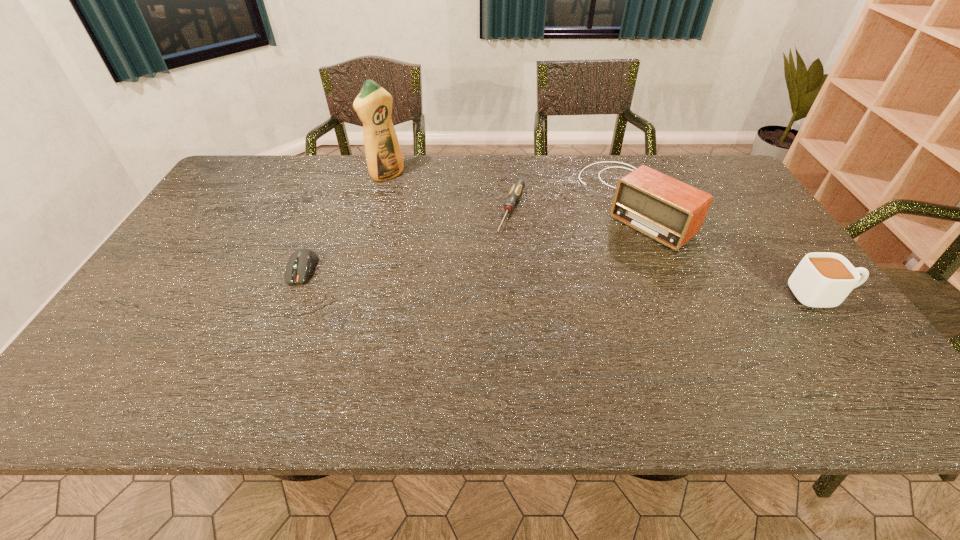
In order to click on computer equipment in this screenshot , I will do `click(300, 264)`.

Image resolution: width=960 pixels, height=540 pixels. In order to click on the fourth tallest object in this screenshot , I will do `click(300, 264)`.

Identify the location of cup. The height and width of the screenshot is (540, 960). (822, 279).

The height and width of the screenshot is (540, 960). In order to click on the third shortest object in this screenshot , I will do `click(822, 279)`.

Find the location of a particular element. Image resolution: width=960 pixels, height=540 pixels. detergent is located at coordinates (373, 104).

This screenshot has width=960, height=540. In order to click on the tallest object in this screenshot , I will do `click(373, 104)`.

Where is `the second tallest object`? the second tallest object is located at coordinates (667, 210).

This screenshot has height=540, width=960. I want to click on the fourth object from left to right, so click(667, 210).

You are a GUI agent. You are given a task and a screenshot of the screen. Output one action in this format:
    pyautogui.click(x=<x>, y=<y>)
    Task: Click on the shortest object
    This screenshot has height=540, width=960.
    Given the screenshot: What is the action you would take?
    pyautogui.click(x=518, y=186)

Identify the location of the third object from left to right. (518, 186).